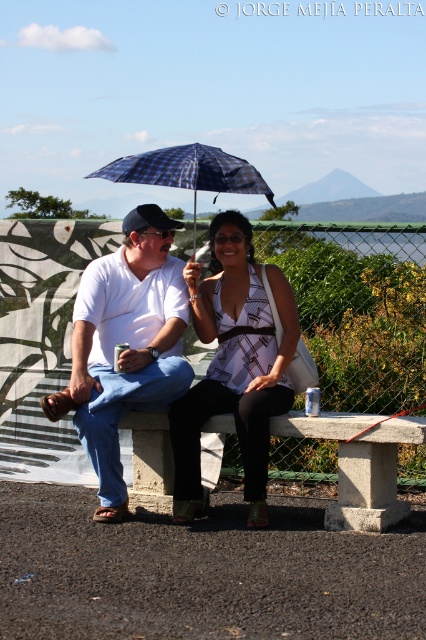
You are a photographer trying to capture a candid shot of the matte white shirt at center and the concrete bench at center. To ensure the shirt is in focus while the bench is slightly blurred, which object should you adjust your camera focus on?

You should focus on the matte white shirt at center since it is located above the concrete bench at center, allowing the bench to be slightly out of focus while the shirt remains sharp.

You are a photographer trying to capture a candid shot of the two people sitting on the bench. You want to ensure that the patterned fabric blouse at center and the blue plaid umbrella at center are both visible in the frame. Which object should you position closer to the left side of your camera viewfinder to achieve this?

You should position the blue plaid umbrella at center closer to the left side of the camera viewfinder because the patterned fabric blouse at center is to the right of the blue plaid umbrella at center. This arrangement will ensure both objects are visible in the frame.

You are a photographer trying to capture a candid shot of the matte white shirt at center. The photographer is standing at the point marked by the coordinates point (127,340). Where should you position yourself relative to this point to ensure the matte white shirt at center is in the frame?

The point (127,340) marks the exact location of the matte white shirt at center, so positioning yourself at this point would place you directly at the shirt, making it difficult to capture a clear shot. Move slightly to the side or back to frame the matte white shirt at center properly.